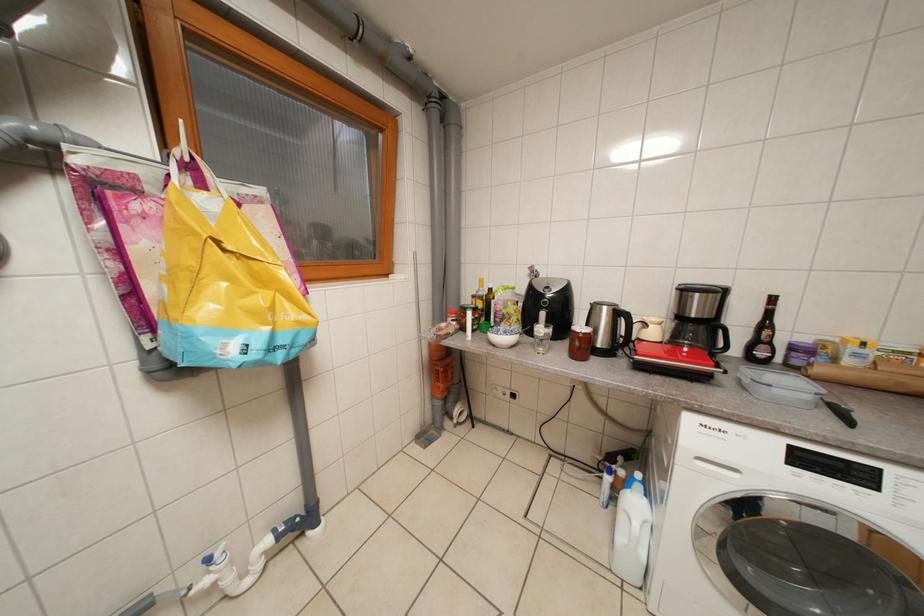
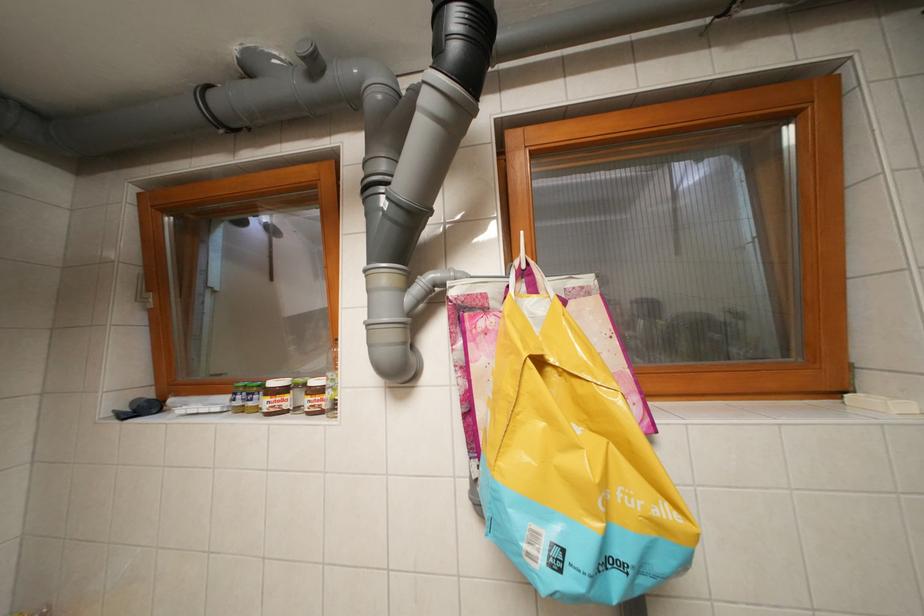
Question: The camera is either moving clockwise (left) or counter-clockwise (right) around the object. The first image is from the beginning of the video and the second image is from the end. Is the camera moving left or right when shooting the video?

Choices:
 (A) Left
 (B) Right

Answer: (B)